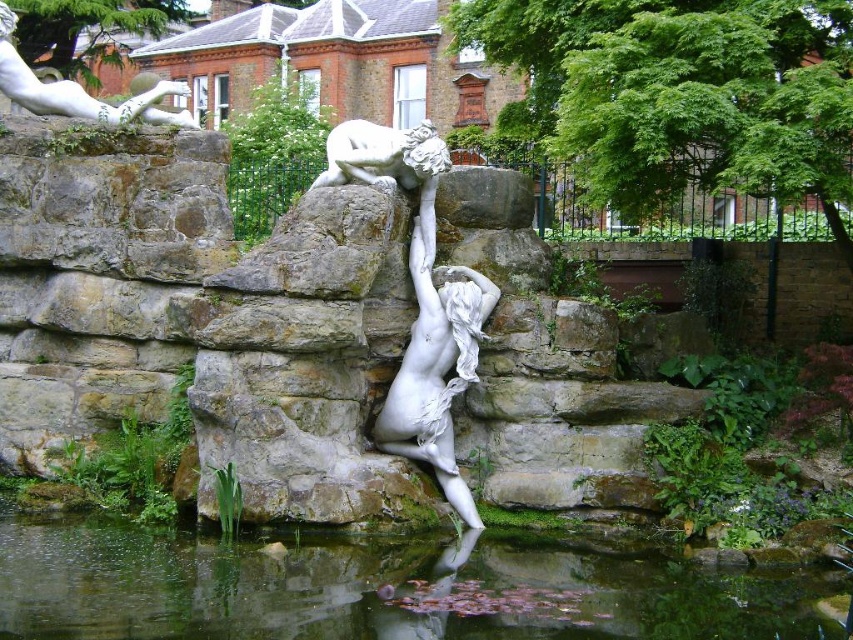
You are planning to place a small wooden boat in the garden. The boat requires a water surface wider than the white marble statue at upper left to navigate safely. Can the clear water at pond center accommodate the boat?

The clear water at pond center is narrower than the white marble statue at upper left, so it cannot accommodate the boat as it requires a wider surface than the statue.

You are a photographer planning to capture the entire scene in one shot. Given that the clear water at pond center and the white marble statue at upper left are both important elements, which object should you ensure is framed to be larger in your composition?

The white marble statue at upper left should be framed to be larger because it is larger than the clear water at pond center according to the description.